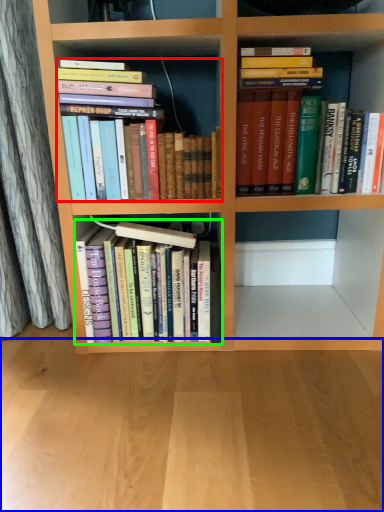
Question: Which is nearer to the book (highlighted by a red box)? plain (highlighted by a blue box) or book (highlighted by a green box).

Choices:
 (A) plain
 (B) book

Answer: (B)